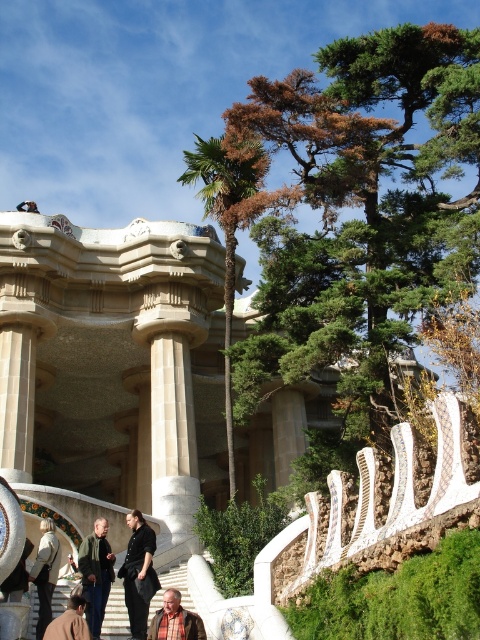
Question: Does black matte shirt at lower center have a greater width compared to green fuzzy jacket at lower left?

Choices:
 (A) no
 (B) yes

Answer: (B)

Question: Which object is farther from the camera taking this photo?

Choices:
 (A) brown leather jacket at lower left
 (B) green leafy palm tree at center
 (C) green fuzzy jacket at lower left

Answer: (B)

Question: Which object is the farthest from the white marble stairs at lower center?

Choices:
 (A) brown plaid shirt at lower center
 (B) black matte shirt at lower center
 (C) brown leather jacket at lower left
 (D) green leafy palm tree at center

Answer: (D)

Question: Does white marble stairs at lower center have a lesser width compared to light brown leather jacket at lower left?

Choices:
 (A) yes
 (B) no

Answer: (B)

Question: Which point appears closest to the camera in this image?

Choices:
 (A) pyautogui.click(x=213, y=144)
 (B) pyautogui.click(x=88, y=573)
 (C) pyautogui.click(x=57, y=561)

Answer: (B)

Question: From the image, what is the correct spatial relationship of green fuzzy jacket at lower left in relation to brown leather jacket at lower left?

Choices:
 (A) below
 (B) above

Answer: (A)